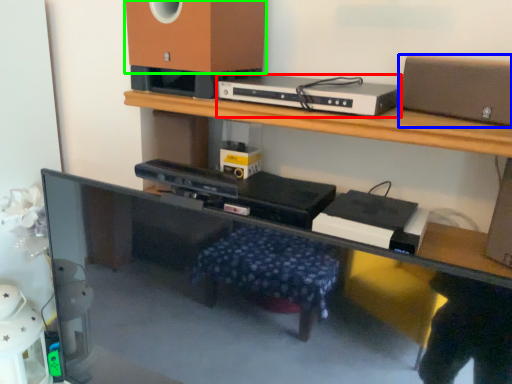
Question: Estimate the real-world distances between objects in this image. Which object is closer to gadget (highlighted by a red box), speaker (highlighted by a blue box) or speaker (highlighted by a green box)?

Choices:
 (A) speaker
 (B) speaker

Answer: (B)